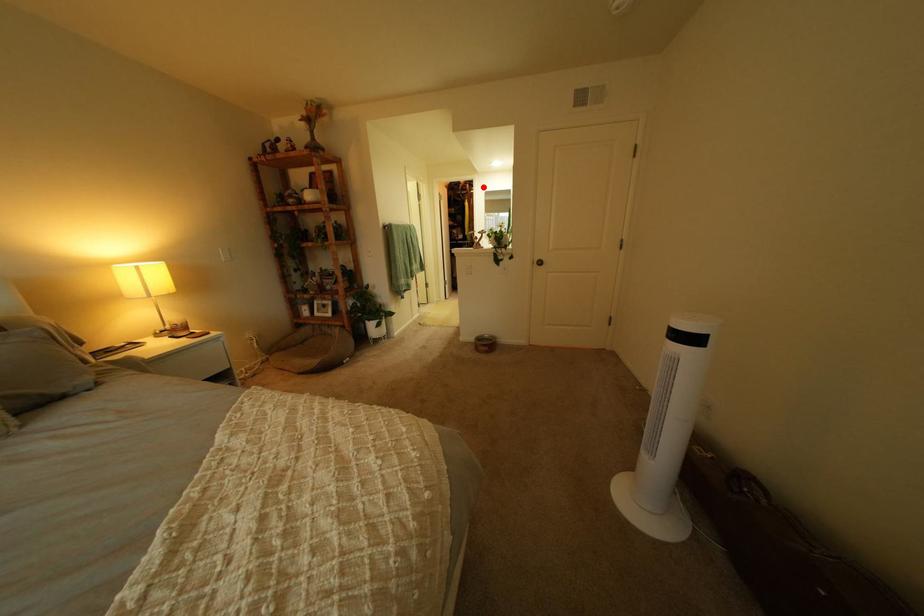
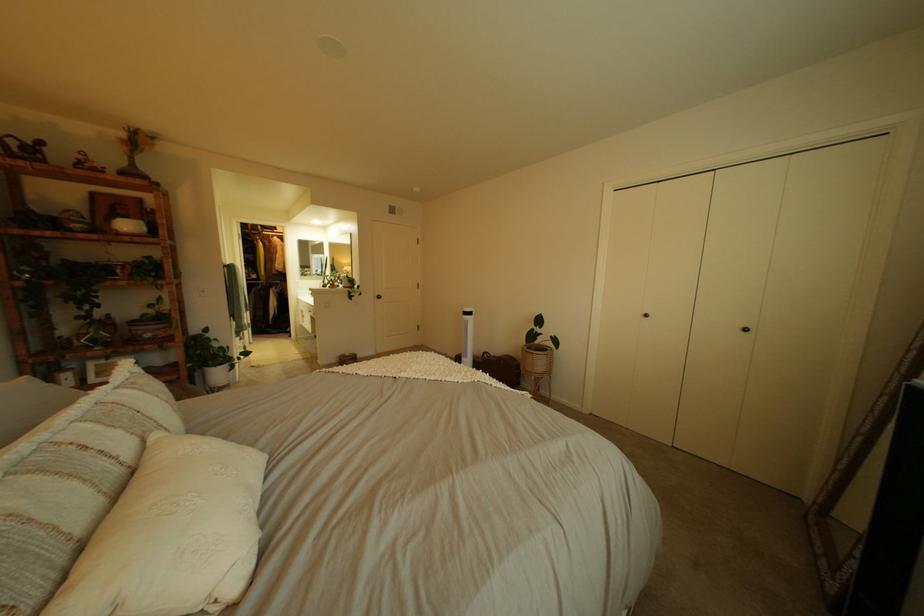
Where in the second image is the point corresponding to the highlighted location from the first image?

(274, 228)